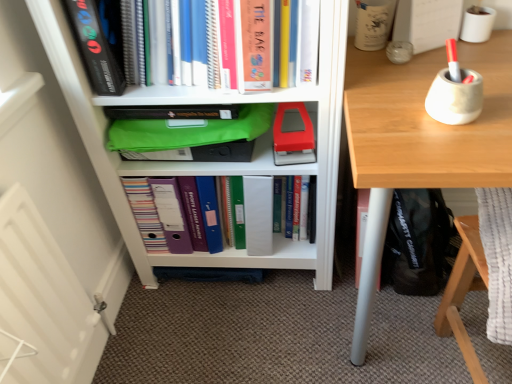
Question: Is hardcover book at center, placed as the second book when sorted from top to bottom, with matte plastic folder at center, which is the first book in bottom-to-top order?

Choices:
 (A) yes
 (B) no

Answer: (B)

Question: Can you confirm if hardcover book at center, arranged as the 2th book when ordered from the bottom, is shorter than matte plastic folder at center, which is the first book in bottom-to-top order?

Choices:
 (A) yes
 (B) no

Answer: (B)

Question: Could you tell me if hardcover book at center, placed as the second book when sorted from top to bottom, is facing matte plastic folder at center, which is the first book in bottom-to-top order?

Choices:
 (A) no
 (B) yes

Answer: (A)

Question: Does hardcover book at center, placed as the second book when sorted from top to bottom, lie in front of matte plastic folder at center, which is the first book in bottom-to-top order?

Choices:
 (A) yes
 (B) no

Answer: (B)

Question: Can you confirm if hardcover book at center, arranged as the 2th book when ordered from the bottom, is taller than matte plastic folder at center, which is counted as the third book, starting from the top?

Choices:
 (A) yes
 (B) no

Answer: (A)

Question: Does hardcover book at center, arranged as the 2th book when ordered from the bottom, appear on the right side of matte plastic folder at center, which is counted as the third book, starting from the top?

Choices:
 (A) yes
 (B) no

Answer: (A)

Question: Could hardcover book at upper center, which is the third book in bottom-to-top order, be considered to be inside matte gray pen holder at upper right, which is the 3th stationery from left to right?

Choices:
 (A) yes
 (B) no

Answer: (B)

Question: From the image's perspective, would you say matte gray pen holder at upper right, which is the 3th stationery from left to right, is positioned over hardcover book at upper center, which is the third book in bottom-to-top order?

Choices:
 (A) no
 (B) yes

Answer: (A)

Question: Is matte gray pen holder at upper right, which appears as the 2th stationery when viewed from the right, beside hardcover book at upper center, which appears as the first book when viewed from the top?

Choices:
 (A) yes
 (B) no

Answer: (B)

Question: Is matte gray pen holder at upper right, which is the 3th stationery from left to right, turned away from hardcover book at upper center, which appears as the first book when viewed from the top?

Choices:
 (A) no
 (B) yes

Answer: (A)

Question: Considering the relative sizes of matte gray pen holder at upper right, which is the 3th stationery from left to right, and hardcover book at upper center, which appears as the first book when viewed from the top, in the image provided, is matte gray pen holder at upper right, which is the 3th stationery from left to right, wider than hardcover book at upper center, which appears as the first book when viewed from the top,?

Choices:
 (A) yes
 (B) no

Answer: (B)

Question: Can you confirm if matte gray pen holder at upper right, which appears as the 2th stationery when viewed from the right, is shorter than hardcover book at upper center, which is the third book in bottom-to-top order?

Choices:
 (A) yes
 (B) no

Answer: (A)

Question: Is hardcover book at upper left, the second paperback book from the bottom, further to the viewer compared to green fabric bag at center?

Choices:
 (A) yes
 (B) no

Answer: (B)